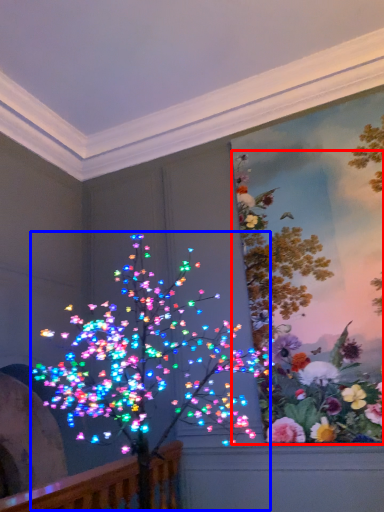
Question: Among these objects, which one is nearest to the camera, floral arrangement (highlighted by a red box) or christmas decoration (highlighted by a blue box)?

Choices:
 (A) floral arrangement
 (B) christmas decoration

Answer: (B)